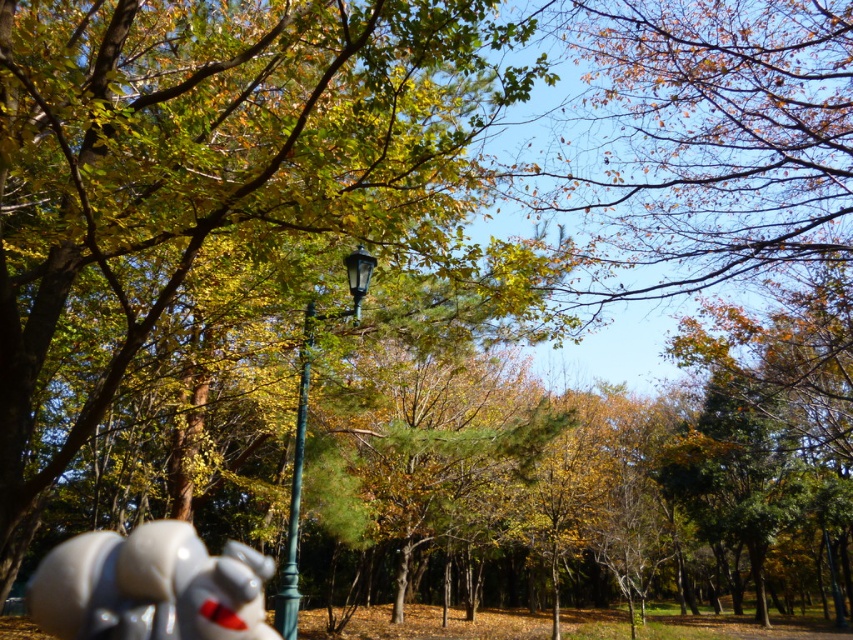
Question: Does white glossy statue at lower left have a lesser width compared to green metal lamp post at center?

Choices:
 (A) yes
 (B) no

Answer: (B)

Question: Does white glossy statue at lower left appear on the left side of green metal lamp post at center?

Choices:
 (A) no
 (B) yes

Answer: (B)

Question: Can you confirm if white glossy statue at lower left is positioned to the left of green metal lamp post at center?

Choices:
 (A) no
 (B) yes

Answer: (B)

Question: Which of the following is the closest to the observer?

Choices:
 (A) (370, 260)
 (B) (198, 550)

Answer: (B)

Question: Which of the following is the farthest from the observer?

Choices:
 (A) (225, 556)
 (B) (308, 371)

Answer: (B)

Question: Among these points, which one is farthest from the camera?

Choices:
 (A) (114, 592)
 (B) (279, 604)

Answer: (B)